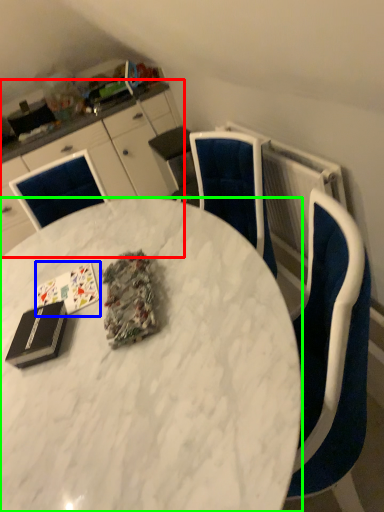
Question: Considering the real-world distances, which object is closest to cabinetry (highlighted by a red box)? card game (highlighted by a blue box) or desk (highlighted by a green box).

Choices:
 (A) card game
 (B) desk

Answer: (B)